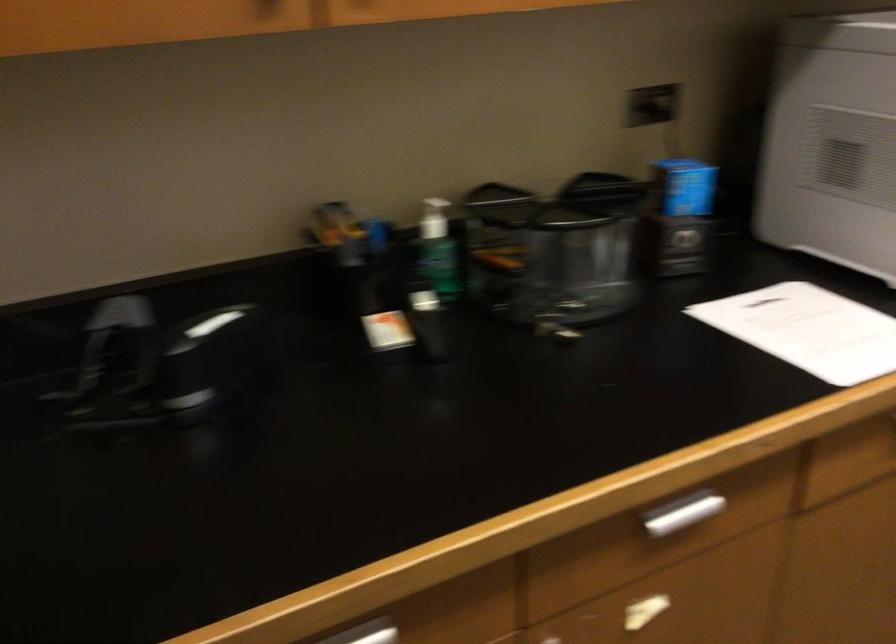
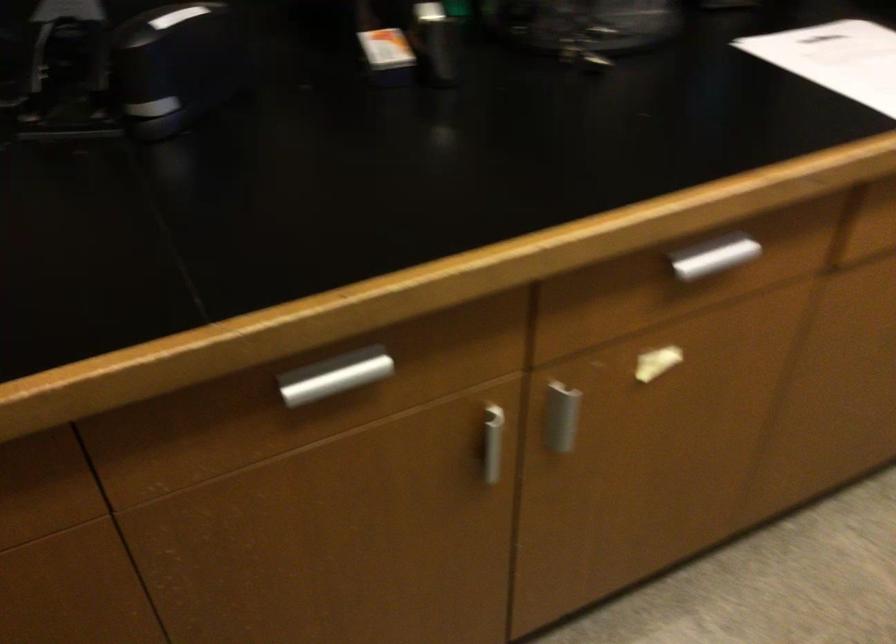
The point at (682, 512) is marked in the first image. Where is the corresponding point in the second image?

(713, 257)